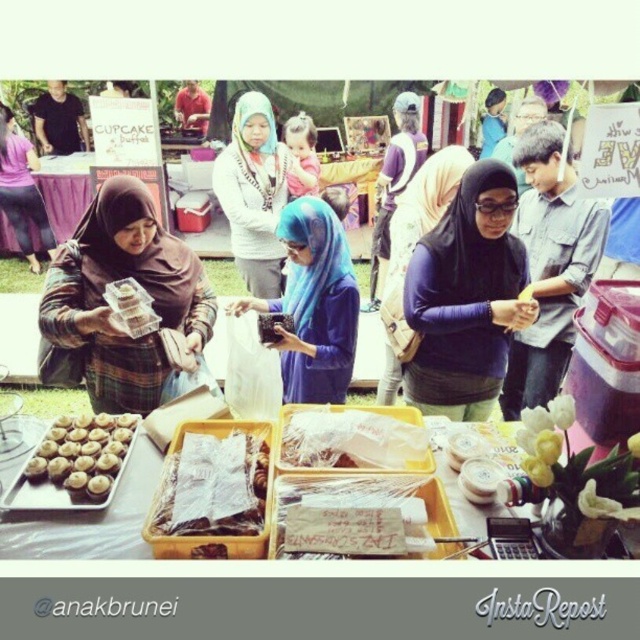
You are a customer at the market and want to buy something from the yellow plastic tray at center. To reach it, you need to walk around the matte brown hijab at center. Is the tray in front of or behind the hijab?

The matte brown hijab at center is further to the viewer than the yellow plastic tray at center, so the tray is behind the hijab.

You are a customer at the market and want to pick up the matte brown hijab at center and the yellow plastic tray at center. However, you can only reach 20 inches. Can you reach both items without moving your position?

The matte brown hijab at center and yellow plastic tray at center are 20.69 inches apart from each other. Since your reach is only 20 inches, you cannot reach both items without moving your position.